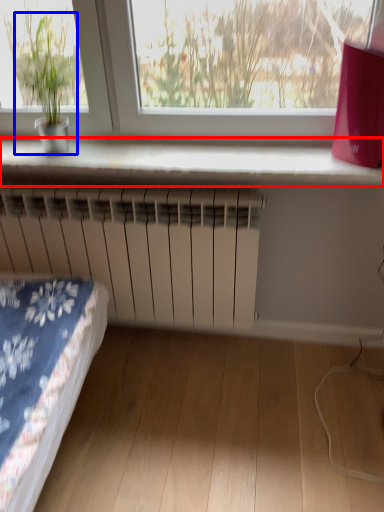
Question: Which object is closer to the camera taking this photo, window sill (highlighted by a red box) or houseplant (highlighted by a blue box)?

Choices:
 (A) window sill
 (B) houseplant

Answer: (B)